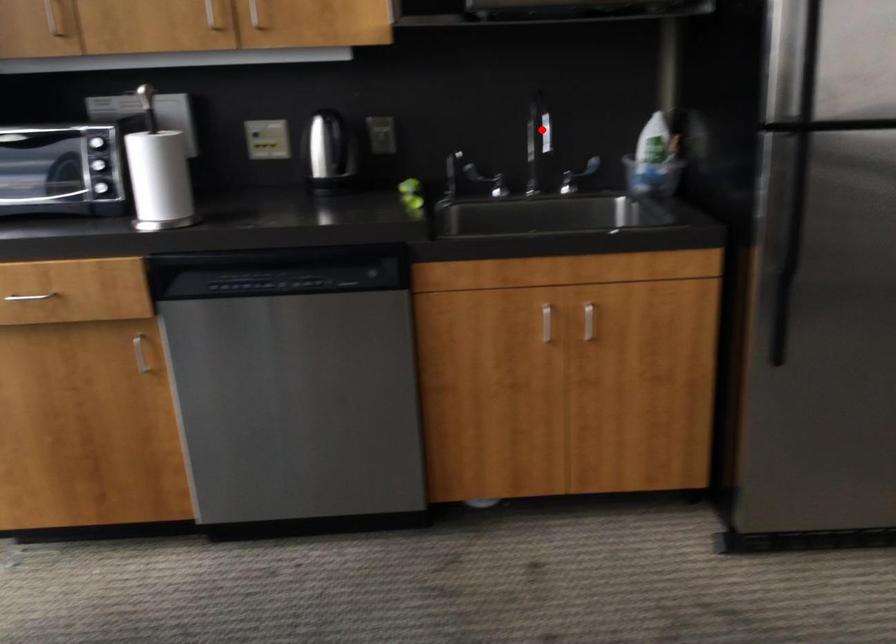
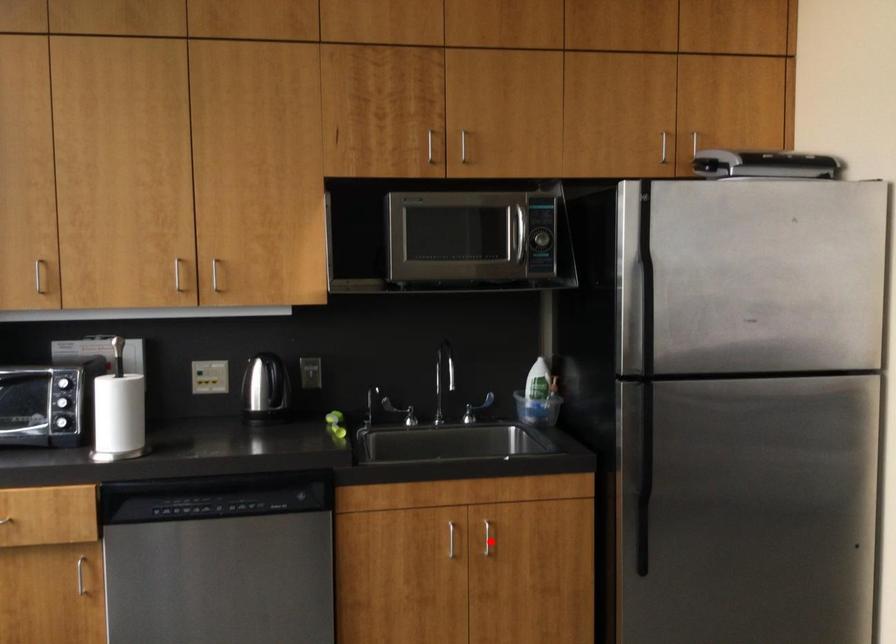
I am providing you with two images of the same scene from different viewpoints. A red point is marked on the first image and another point is marked on the second image. Does the point marked in image1 correspond to the same location as the one in image2?

No